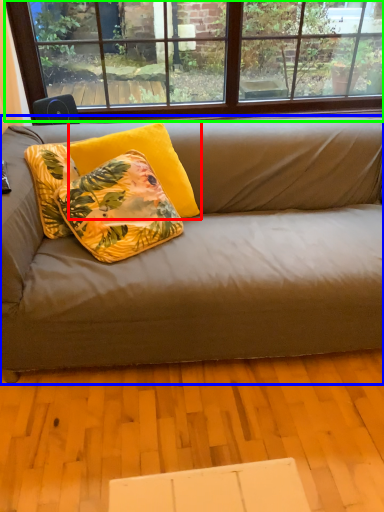
Question: Which object is the farthest from pillow (highlighted by a red box)? Choose among these: studio couch (highlighted by a blue box) or window (highlighted by a green box).

Choices:
 (A) studio couch
 (B) window

Answer: (B)